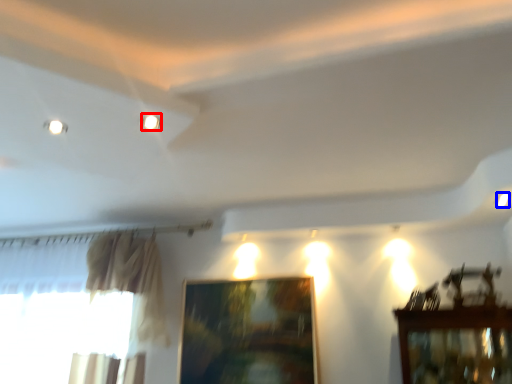
Question: Which point is closer to the camera, lighting (highlighted by a red box) or light (highlighted by a blue box)?

Choices:
 (A) lighting
 (B) light

Answer: (A)